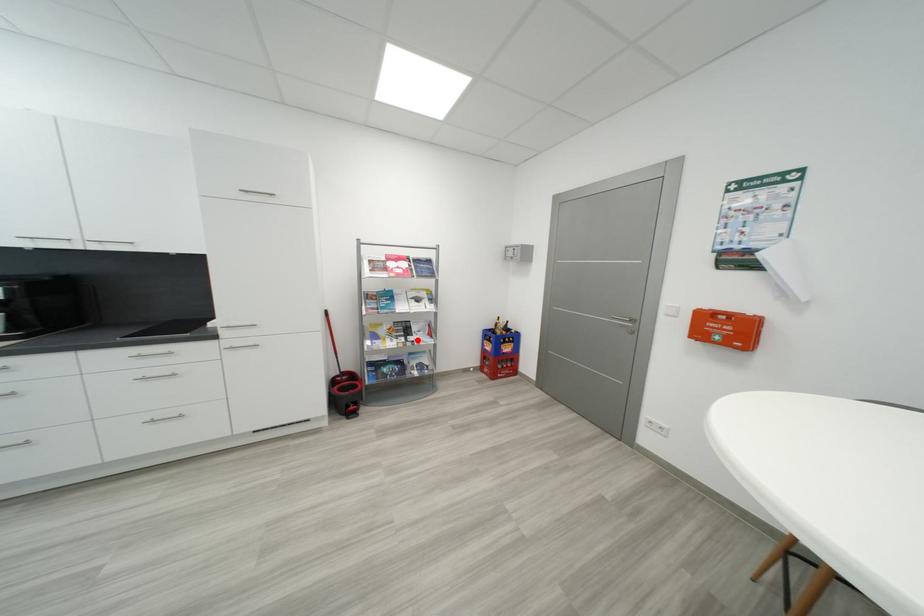
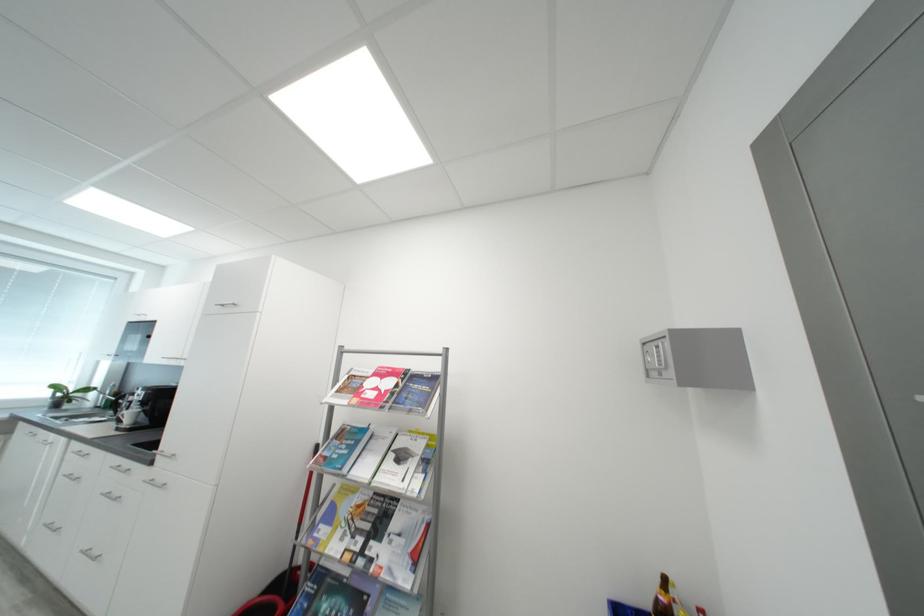
Find the pixel in the second image that matches the highlighted location in the first image.

(380, 549)